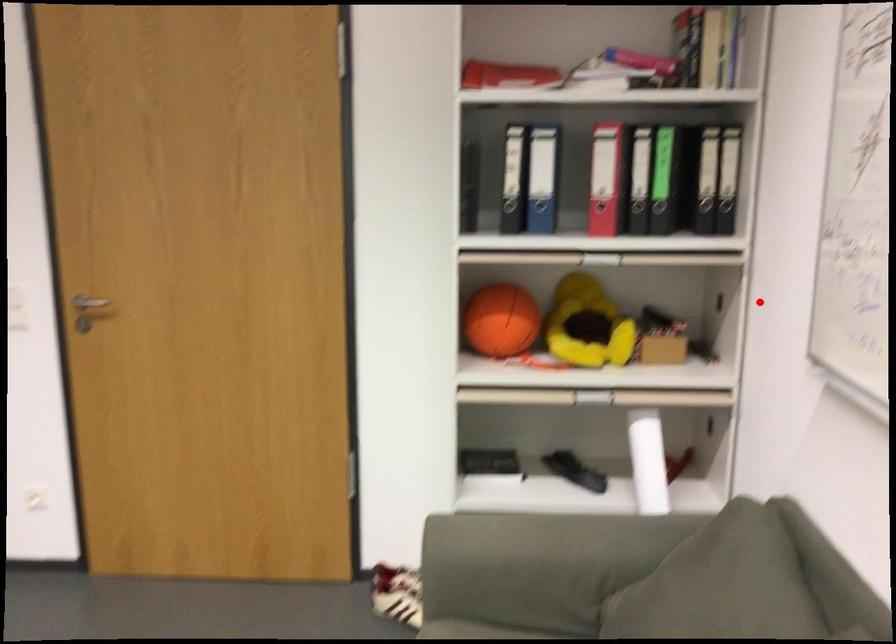
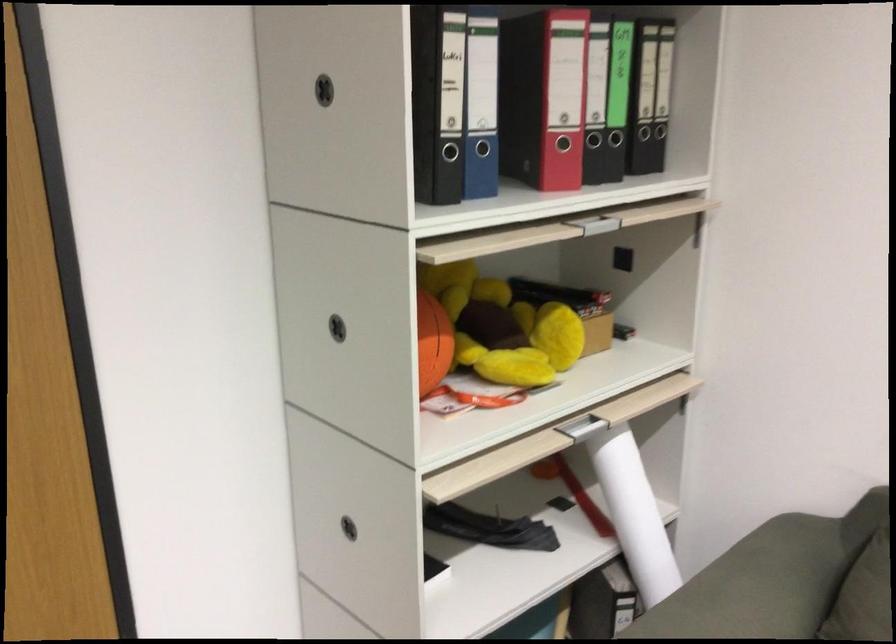
Question: I am providing you with two images of the same scene from different viewpoints. In image1, a red point is highlighted. Considering the same 3D point in image2, which of the following is correct?

Choices:
 (A) It is closer
 (B) It is farther

Answer: (A)